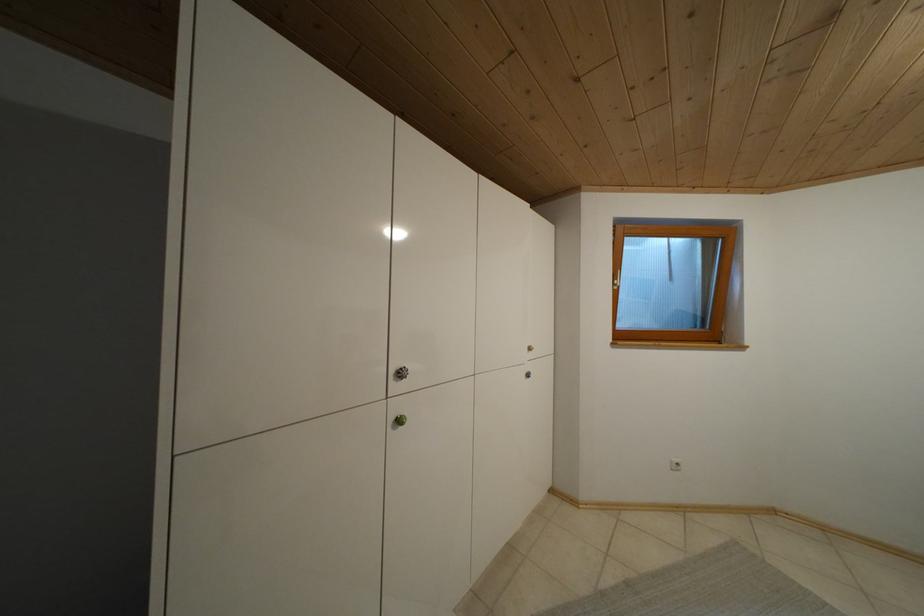
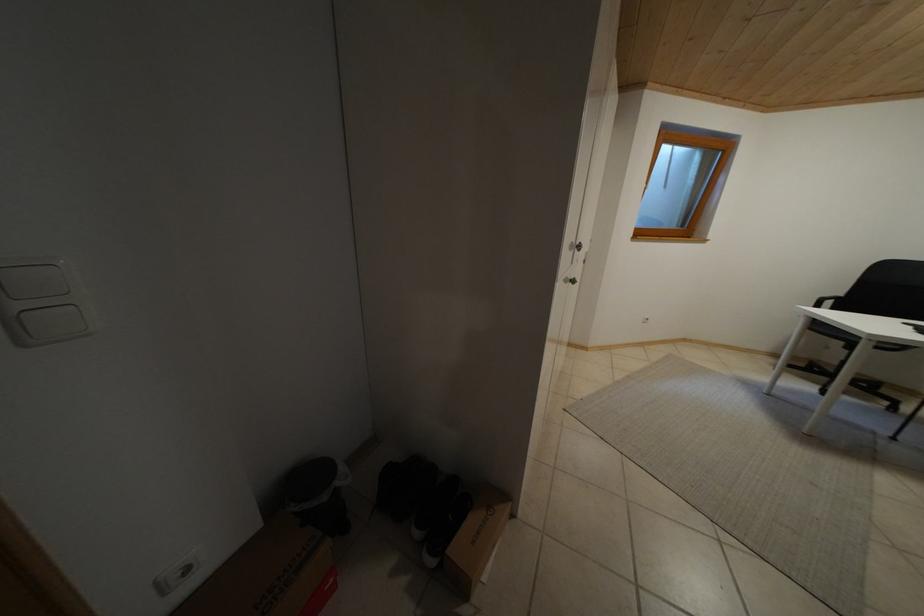
Question: What movement of the cameraman would produce the second image?

Choices:
 (A) Left
 (B) Right
 (C) Forward
 (D) Backward

Answer: (A)